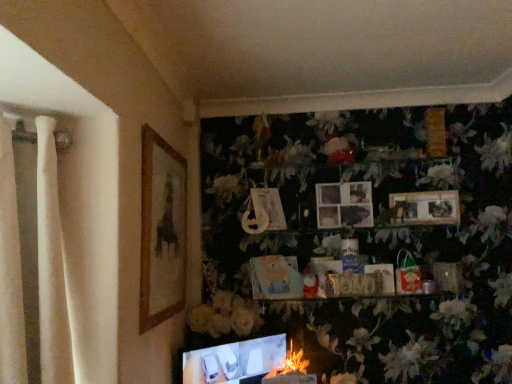
This screenshot has height=384, width=512. What do you see at coordinates (291, 363) in the screenshot?
I see `fluffy white flower at lower center, which is the 2th flower from top to bottom` at bounding box center [291, 363].

This screenshot has width=512, height=384. What do you see at coordinates (234, 361) in the screenshot?
I see `matte black laptop at lower center` at bounding box center [234, 361].

Measure the distance between point (256, 230) and camera.

A distance of 6.64 feet exists between point (256, 230) and camera.

The width and height of the screenshot is (512, 384). Find the location of `white matte flower at center, the second flower when ordered from right to left`. white matte flower at center, the second flower when ordered from right to left is located at coordinates (225, 316).

Considering the points (245, 226) and (250, 306), which point is behind, point (245, 226) or point (250, 306)?

Positioned behind is point (245, 226).

Relative to white matte flower at center, the second flower when ordered from right to left, is matte plastic picture frame at center, the fourth picture frame in the right-to-left sequence, in front or behind?

Clearly, matte plastic picture frame at center, the fourth picture frame in the right-to-left sequence, is behind white matte flower at center, the second flower when ordered from right to left.

Would you say matte plastic picture frame at center, the fourth picture frame in the right-to-left sequence, contains white matte flower at center, the second flower when ordered from right to left?

No.

From a real-world perspective, relative to white matte flower at center, the second flower when ordered from right to left, is matte plastic picture frame at center, the fourth picture frame in the right-to-left sequence, vertically above or below?

matte plastic picture frame at center, the fourth picture frame in the right-to-left sequence, is situated higher than white matte flower at center, the second flower when ordered from right to left, in the real world.

Looking at their sizes, would you say fluffy white flower at lower center, which is the 2th flower from top to bottom, is wider or thinner than white matte flower at center, positioned as the first flower in left-to-right order?

In the image, fluffy white flower at lower center, which is the 2th flower from top to bottom, appears to be more narrow than white matte flower at center, positioned as the first flower in left-to-right order.

Does fluffy white flower at lower center, acting as the 2th flower starting from the left, have a lesser height compared to white matte flower at center, the second flower when ordered from right to left?

Yes.

Is white matte flower at center, which ranks as the 2th flower in bottom-to-top order, at the back of fluffy white flower at lower center, acting as the 2th flower starting from the left?

fluffy white flower at lower center, acting as the 2th flower starting from the left, is not turned away from white matte flower at center, which ranks as the 2th flower in bottom-to-top order.

Does point (446, 209) come farther from viewer compared to point (271, 273)?

That is True.

Is wooden photo frame at upper center, the fifth picture frame in the left-to-right sequence, not close to matte cardboard picture frame at center, arranged as the third picture frame when viewed from the right?

No, wooden photo frame at upper center, the fifth picture frame in the left-to-right sequence, is not far away from matte cardboard picture frame at center, arranged as the third picture frame when viewed from the right.

Can you tell me how much wooden photo frame at upper center, the fifth picture frame in the left-to-right sequence, and matte cardboard picture frame at center, arranged as the third picture frame when viewed from the right, differ in facing direction?

They differ by 42.7 degrees in their facing directions.

Could you tell me if wooden photo frame at upper center, the 1th picture frame in the right-to-left sequence, is turned towards matte cardboard picture frame at center, marked as the third picture frame in a left-to-right arrangement?

No, wooden photo frame at upper center, the 1th picture frame in the right-to-left sequence, is not turned towards matte cardboard picture frame at center, marked as the third picture frame in a left-to-right arrangement.

From the image's perspective, which is above, white matte flower at center, the second flower when ordered from right to left, or matte plastic picture frame at center, the fourth picture frame in the right-to-left sequence?

matte plastic picture frame at center, the fourth picture frame in the right-to-left sequence, from the image's perspective.

Is white matte flower at center, acting as the 1th flower starting from the top, in contact with matte plastic picture frame at center, the fourth picture frame in the right-to-left sequence?

No, white matte flower at center, acting as the 1th flower starting from the top, is not next to matte plastic picture frame at center, the fourth picture frame in the right-to-left sequence.

Considering the points (220, 315) and (273, 213), which point is in front, point (220, 315) or point (273, 213)?

The point (220, 315) is in front.

Does white matte flower at center, positioned as the first flower in left-to-right order, lie behind matte plastic picture frame at center, the fourth picture frame in the right-to-left sequence?

That is False.

Identify the location of the 1st picture frame above the matte cardboard picture frame at center, marked as the third picture frame in a left-to-right arrangement (from the image's perspective). (162, 231).

From the image's perspective, is matte cardboard picture frame at center, arranged as the third picture frame when viewed from the right, above wooden picture frame at left, the fifth picture frame positioned from the right?

Incorrect, from the image's perspective, matte cardboard picture frame at center, arranged as the third picture frame when viewed from the right, is lower than wooden picture frame at left, the fifth picture frame positioned from the right.

From a real-world perspective, which object stands above the other?

From a 3D spatial view, wooden picture frame at left, which is the first picture frame in left-to-right order, is above.

Is matte cardboard picture frame at center, arranged as the third picture frame when viewed from the right, positioned in front of wooden picture frame at left, which is the first picture frame in left-to-right order?

No, matte cardboard picture frame at center, arranged as the third picture frame when viewed from the right, is further to the viewer.

Could you tell me if wooden photo frame at upper center, the fifth picture frame in the left-to-right sequence, is turned towards matte black laptop at lower center?

No, wooden photo frame at upper center, the fifth picture frame in the left-to-right sequence, is not aimed at matte black laptop at lower center.

Is wooden photo frame at upper center, the 1th picture frame in the right-to-left sequence, closer to camera compared to matte black laptop at lower center?

No, the depth of wooden photo frame at upper center, the 1th picture frame in the right-to-left sequence, is greater than that of matte black laptop at lower center.

Does wooden photo frame at upper center, the 1th picture frame in the right-to-left sequence, have a larger size compared to matte black laptop at lower center?

Incorrect, wooden photo frame at upper center, the 1th picture frame in the right-to-left sequence, is not larger than matte black laptop at lower center.

Is wooden photo frame at upper center, the fifth picture frame in the left-to-right sequence, to the left of matte black laptop at lower center from the viewer's perspective?

Incorrect, wooden photo frame at upper center, the fifth picture frame in the left-to-right sequence, is not on the left side of matte black laptop at lower center.

Does fluffy white flower at lower center, which is the 2th flower from top to bottom, touch matte black laptop at lower center?

There is a gap between fluffy white flower at lower center, which is the 2th flower from top to bottom, and matte black laptop at lower center.

Choose the correct answer: Is fluffy white flower at lower center, which ranks as the 1th flower in bottom-to-top order, inside matte black laptop at lower center or outside it?

fluffy white flower at lower center, which ranks as the 1th flower in bottom-to-top order, exists entirely within matte black laptop at lower center.

From a real-world perspective, is fluffy white flower at lower center, which ranks as the 1th flower in bottom-to-top order, physically above matte black laptop at lower center?

No, from a real-world perspective, fluffy white flower at lower center, which ranks as the 1th flower in bottom-to-top order, is not above matte black laptop at lower center.

Identify the location of the 4th picture frame above the white matte flower at center, which ranks as the 2th flower in bottom-to-top order (from a real-world perspective). (263, 211).

This screenshot has height=384, width=512. In order to click on flower above the fluffy white flower at lower center, which ranks as the 1th flower in bottom-to-top order (from the image's perspective) in this screenshot , I will do `click(225, 316)`.

Considering their positions, is fluffy white flower at lower center, which is the 2th flower from top to bottom, positioned closer to white matte flower at center, positioned as the first flower in left-to-right order, than wooden photo frame at upper center, the 1th picture frame in the right-to-left sequence?

fluffy white flower at lower center, which is the 2th flower from top to bottom, is positioned closer to the anchor white matte flower at center, positioned as the first flower in left-to-right order.

From the image, which object appears to be nearer to wooden picture frame at left, which is the first picture frame in left-to-right order, matte cardboard picture frame at center, arranged as the third picture frame when viewed from the right, or matte black laptop at lower center?

matte black laptop at lower center.

When comparing their distances from matte cardboard picture frame at center, arranged as the third picture frame when viewed from the right, does fluffy white flower at lower center, acting as the 2th flower starting from the left, or matte black laptop at lower center seem further?

Among the two, fluffy white flower at lower center, acting as the 2th flower starting from the left, is located further to matte cardboard picture frame at center, arranged as the third picture frame when viewed from the right.

Which object lies nearer to the anchor point wooden picture frame at left, the fifth picture frame positioned from the right, matte cardboard picture frame at center, arranged as the third picture frame when viewed from the right, or wooden photo frame at upper center, the fifth picture frame in the left-to-right sequence?

Based on the image, matte cardboard picture frame at center, arranged as the third picture frame when viewed from the right, appears to be nearer to wooden picture frame at left, the fifth picture frame positioned from the right.

Estimate the real-world distances between objects in this image. Which object is closer to matte wooden picture frame at center, acting as the 2th picture frame starting from the right, matte cardboard picture frame at center, marked as the third picture frame in a left-to-right arrangement, or wooden photo frame at upper center, the fifth picture frame in the left-to-right sequence?

wooden photo frame at upper center, the fifth picture frame in the left-to-right sequence, is positioned closer to the anchor matte wooden picture frame at center, acting as the 2th picture frame starting from the right.

Estimate the real-world distances between objects in this image. Which object is further from matte black laptop at lower center, matte plastic picture frame at center, the fourth picture frame in the right-to-left sequence, or wooden picture frame at left, which is the first picture frame in left-to-right order?

matte plastic picture frame at center, the fourth picture frame in the right-to-left sequence, lies further to matte black laptop at lower center than the other object.

Looking at this image, from the image, which object appears to be farther from white matte flower at center, positioned as the first flower in left-to-right order, matte black laptop at lower center or wooden picture frame at left, the fifth picture frame positioned from the right?

Among the two, wooden picture frame at left, the fifth picture frame positioned from the right, is located further to white matte flower at center, positioned as the first flower in left-to-right order.

Estimate the real-world distances between objects in this image. Which object is further from matte plastic picture frame at center, the fourth picture frame in the right-to-left sequence, wooden photo frame at upper center, the fifth picture frame in the left-to-right sequence, or matte wooden picture frame at center, acting as the 2th picture frame starting from the right?

Based on the image, wooden photo frame at upper center, the fifth picture frame in the left-to-right sequence, appears to be further to matte plastic picture frame at center, the fourth picture frame in the right-to-left sequence.

The width and height of the screenshot is (512, 384). I want to click on computer monitor between white matte flower at center, the second flower when ordered from right to left, and fluffy white flower at lower center, the first flower in the right-to-left sequence, in the vertical direction, so click(x=234, y=361).

What are the coordinates of `picture frame between matte cardboard picture frame at center, arranged as the third picture frame when viewed from the right, and wooden photo frame at upper center, the fifth picture frame in the left-to-right sequence, from left to right` in the screenshot? It's located at (344, 205).

In order to click on computer monitor between wooden picture frame at left, the fifth picture frame positioned from the right, and fluffy white flower at lower center, which is the 2th flower from top to bottom, from top to bottom in this screenshot , I will do tap(234, 361).

Image resolution: width=512 pixels, height=384 pixels. Find the location of `flower between matte cardboard picture frame at center, arranged as the third picture frame when viewed from the right, and matte black laptop at lower center vertically`. flower between matte cardboard picture frame at center, arranged as the third picture frame when viewed from the right, and matte black laptop at lower center vertically is located at coordinates (225, 316).